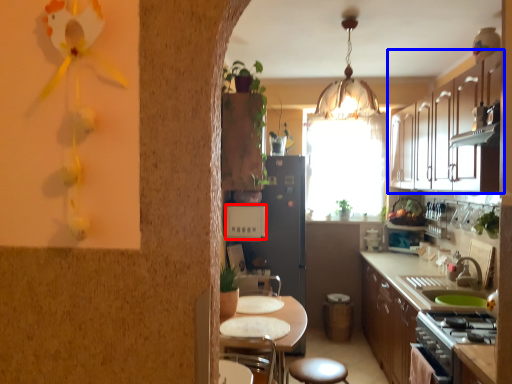
Question: Among these objects, which one is nearest to the camera, appliance (highlighted by a red box) or cabinetry (highlighted by a blue box)?

Choices:
 (A) appliance
 (B) cabinetry

Answer: (B)